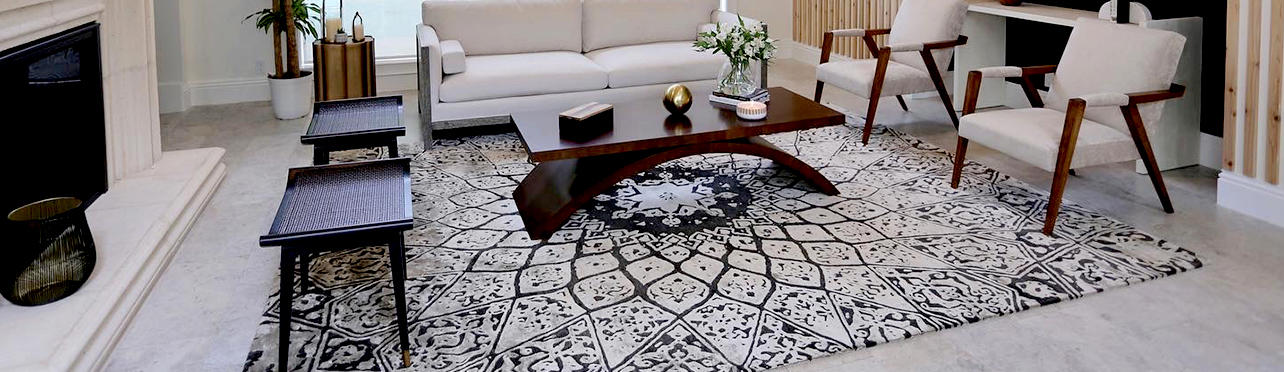
You are a GUI agent. You are given a task and a screenshot of the screen. Output one action in this format:
    pyautogui.click(x=<x>, y=<y>)
    Task: Click on the window
    This screenshot has height=372, width=1284.
    Given the screenshot: What is the action you would take?
    pyautogui.click(x=397, y=24)